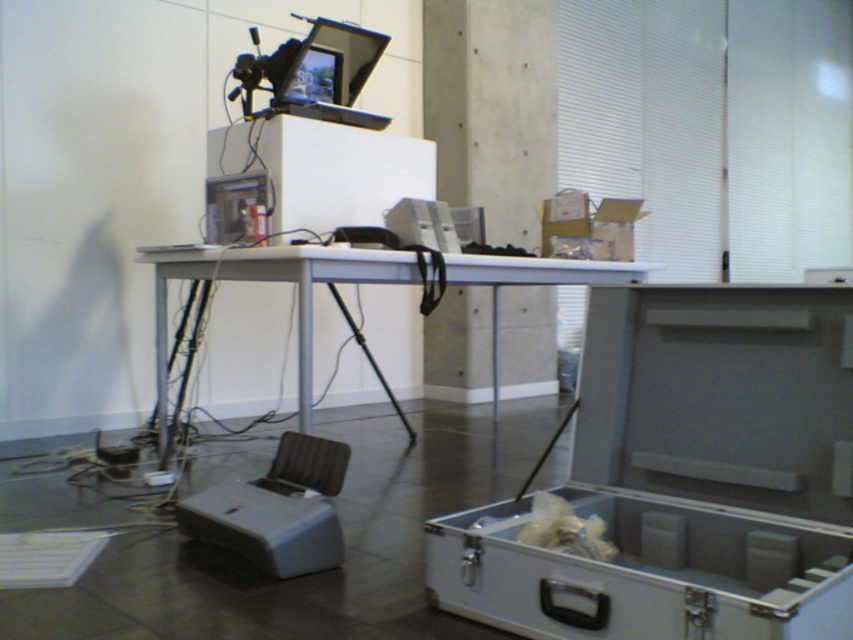
You are standing at the point labeled point (846, 339) in the image. You want to reach the white table at the center without stepping on any cables. The cables are scattered around the table. Can you safely walk straight from your current position to the white table at the center?

The distance between you and the white table at the center is 1.50 meters. Since the cables are scattered around the table, it is possible that walking straight might lead you to step on some cables. To ensure safety, it is advisable to check the path for cables before proceeding.

You are a delivery person who needs to place a package that is 1.2 meters long on the floor near the metallic gray cooler at lower right. Based on the scene described, can you safely place the package without it overlapping the cooler or other nearby objects?

The metallic gray cooler at lower right is 1.11 meters away from the camera. Since the package is 1.2 meters long, placing it near the cooler might cause it to overlap with the cooler or other objects nearby, so it is not safe to place the package there.

You are standing at the center of the room where the white table is located. You need to place a new equipment box at the same position as the metallic gray cooler at lower right. What are the coordinates of the point where you should place the box?

The coordinates for the metallic gray cooler at lower right are at point [685,477]. Therefore, you should place the new equipment box at coordinates [685,477].